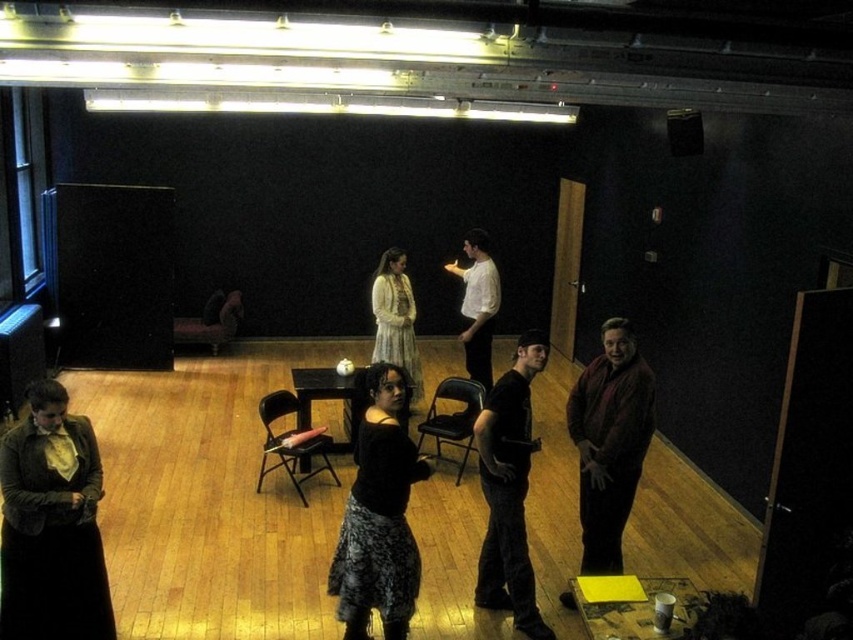
Question: Which point is closer to the camera taking this photo?

Choices:
 (A) click(611, 401)
 (B) click(488, 401)

Answer: (B)

Question: Observing the image, what is the correct spatial positioning of black matte skirt at center in reference to matte white dress at center?

Choices:
 (A) right
 (B) left

Answer: (A)

Question: Considering the relative positions of matte white dress at center and white smooth shirt at center in the image provided, where is matte white dress at center located with respect to white smooth shirt at center?

Choices:
 (A) left
 (B) right

Answer: (A)

Question: Observing the image, what is the correct spatial positioning of black matte skirt at center in reference to matte white dress at center?

Choices:
 (A) below
 (B) above

Answer: (A)

Question: Which of these objects is positioned farthest from the matte white dress at center?

Choices:
 (A) matte brown jacket at lower left
 (B) black matte shirt at center

Answer: (A)

Question: Which of these objects is positioned farthest from the maroon wool sweater at center?

Choices:
 (A) matte brown jacket at lower left
 (B) white smooth shirt at center
 (C) matte white dress at center

Answer: (C)